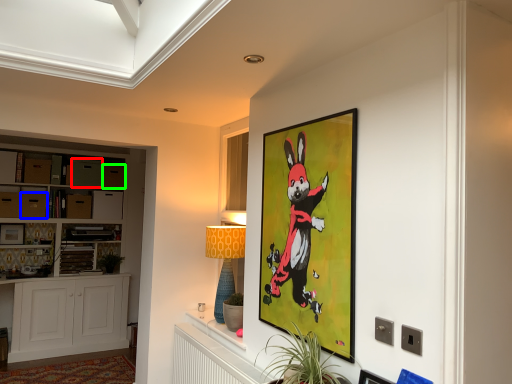
Question: Considering the real-world distances, which object is closest to drawer (highlighted by a red box)? drawer (highlighted by a blue box) or drawer (highlighted by a green box).

Choices:
 (A) drawer
 (B) drawer

Answer: (B)